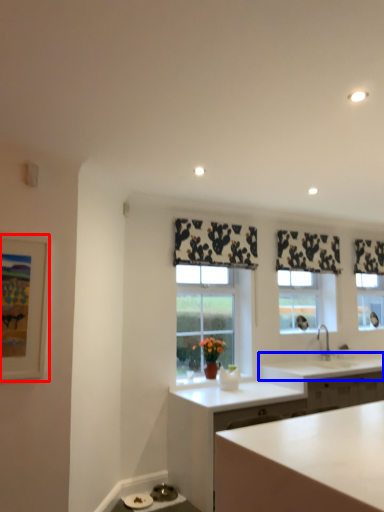
Question: Which object is closer to the camera taking this photo, picture frame (highlighted by a red box) or countertop (highlighted by a blue box)?

Choices:
 (A) picture frame
 (B) countertop

Answer: (A)